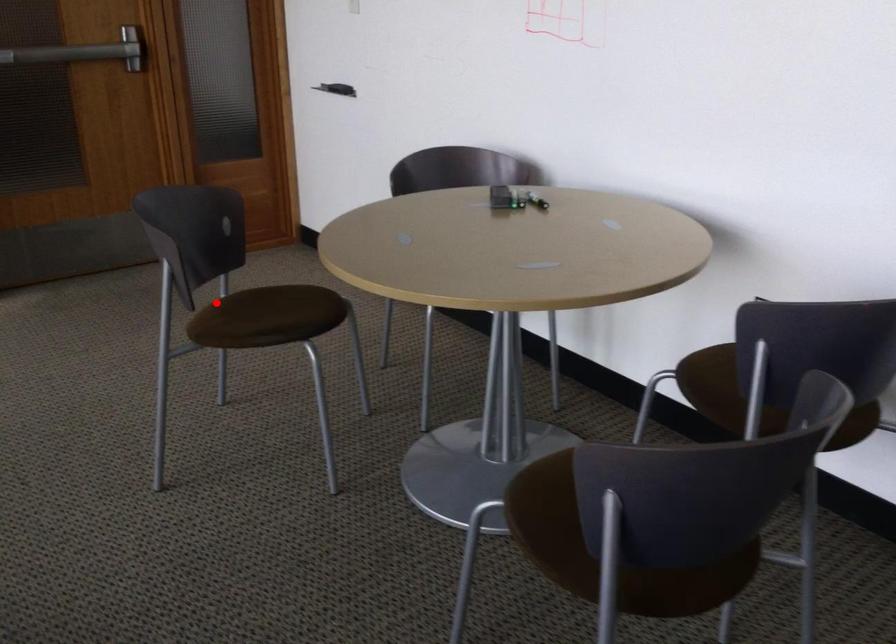
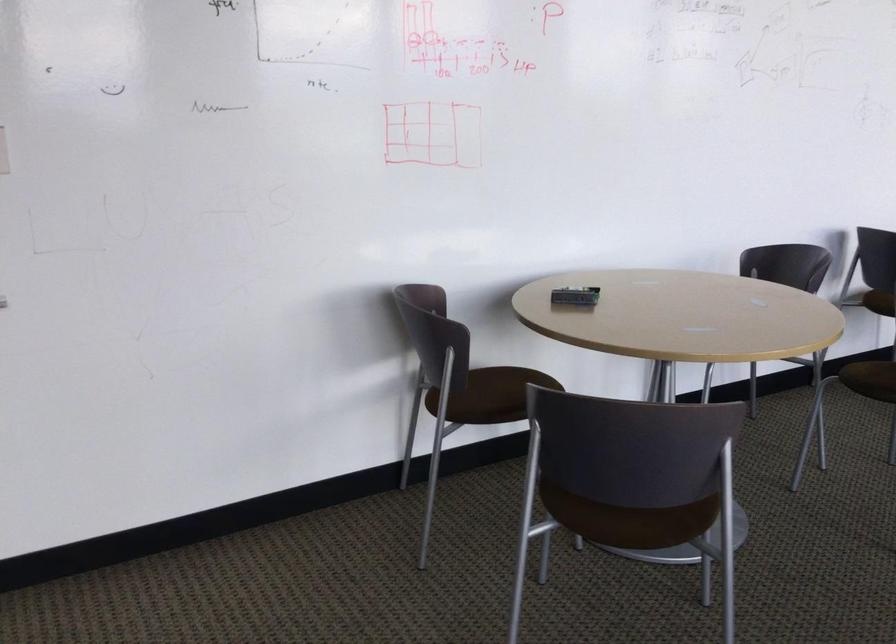
Question: A red point is marked in image1. In image2, is the corresponding 3D point closer to the camera or farther? Reply with the corresponding letter.

Choices:
 (A) The corresponding 3D point is closer.
 (B) The corresponding 3D point is farther.

Answer: (A)